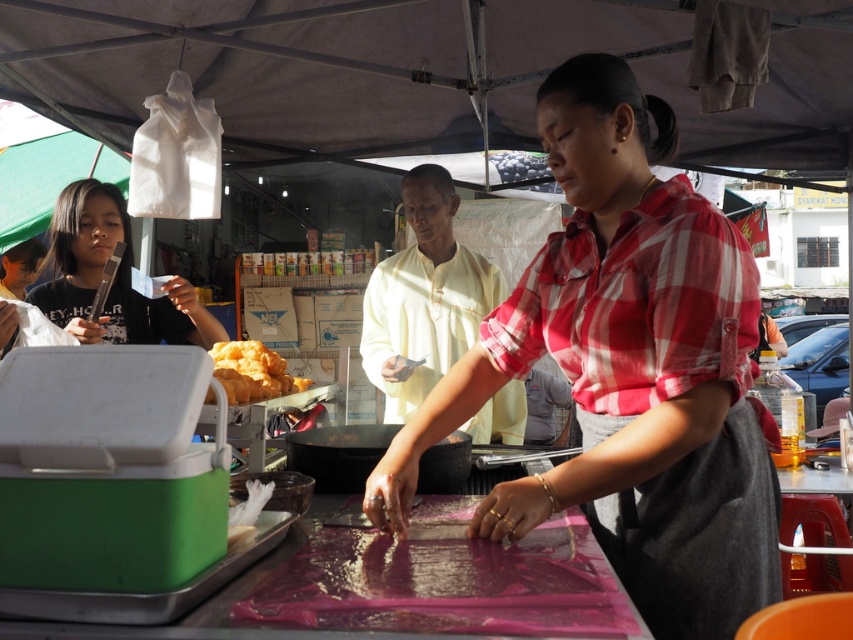
You are a customer standing at the food stall and want to know which of the two points, point (596, 243) or point (228, 388), is closer to you. Based on the scene description, can you determine which point is nearer?

Point (596, 243) is in front of point (228, 388), so it is closer to you.

You are a customer at the food stall and want to know if the golden crispy fried food at center is smaller than the yellow cotton shirt at center. Based on the scene description, can you confirm this?

The yellow cotton shirt at center is larger in size than golden crispy fried food at center, so yes, the golden crispy fried food at center is smaller than the yellow cotton shirt at center.

You are a food critic standing 3 feet away from the plaid fabric shirt at center. You want to taste the golden crispy fried food at center without moving closer. Can you reach it with a 28 inch fork?

The plaid fabric shirt at center is 26.11 inches away from golden crispy fried food at center. Since you are 3 feet away from the plaid fabric shirt at center, the total distance to the golden crispy fried food at center would be 3 feet plus 26.11 inches. Converting 3 feet to inches gives 36 inches, so the total distance is 36 inches plus 26.11 inches equals 62.11 inches. The 28 inch fork is too short to reach 62.11 inches. Therefore, you cannot reach the golden crispy fried food at center with the fork.